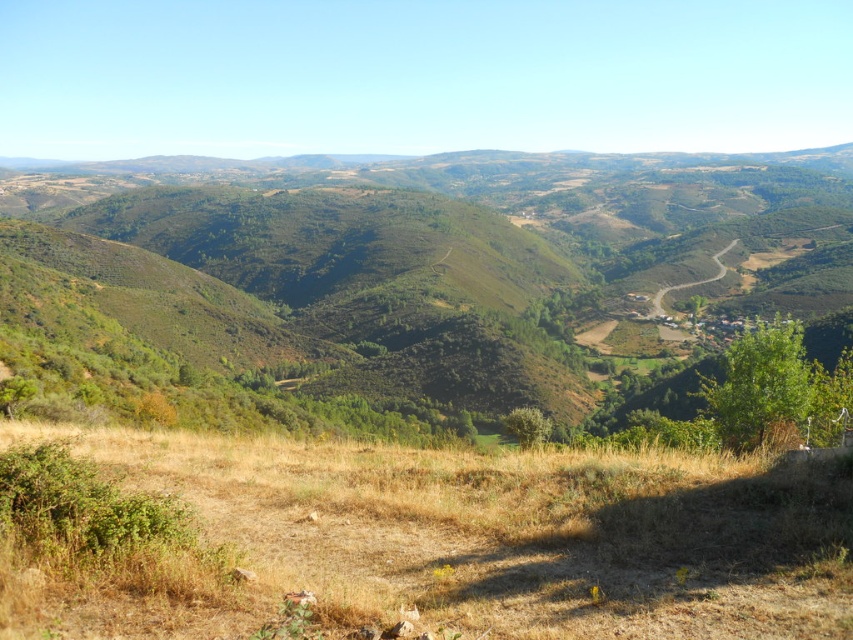
You are standing at the point closer to the horizon in the hilly landscape. Which point are you at, point [444,268] or point [245,612]?

You are at point [245,612] because it is closer to the horizon than point [444,268], which is closer to the viewer.

Consider the image. You are a hiker standing at the dry grass at lower center and want to reach the green leafy hillside at center. Which direction should you move to get there?

The green leafy hillside at center is to the left of dry grass at lower center, so you should move to the left to reach it.

You are standing at the center of the image and want to walk to the green leafy hillside at center. In which direction should you go?

The green leafy hillside at center is located at point coordinates (415, 282), so you should walk towards the center of the image to reach it.